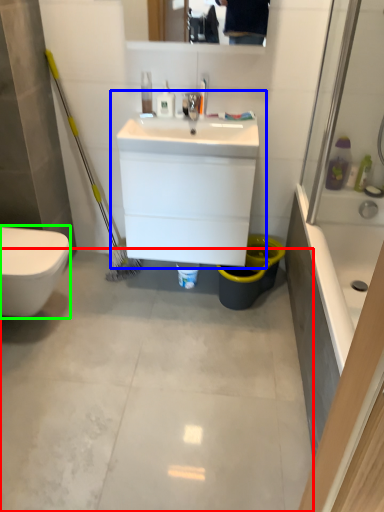
Question: Which object is the farthest from concrete (highlighted by a red box)? Choose among these: sink (highlighted by a blue box) or bidet (highlighted by a green box).

Choices:
 (A) sink
 (B) bidet

Answer: (A)